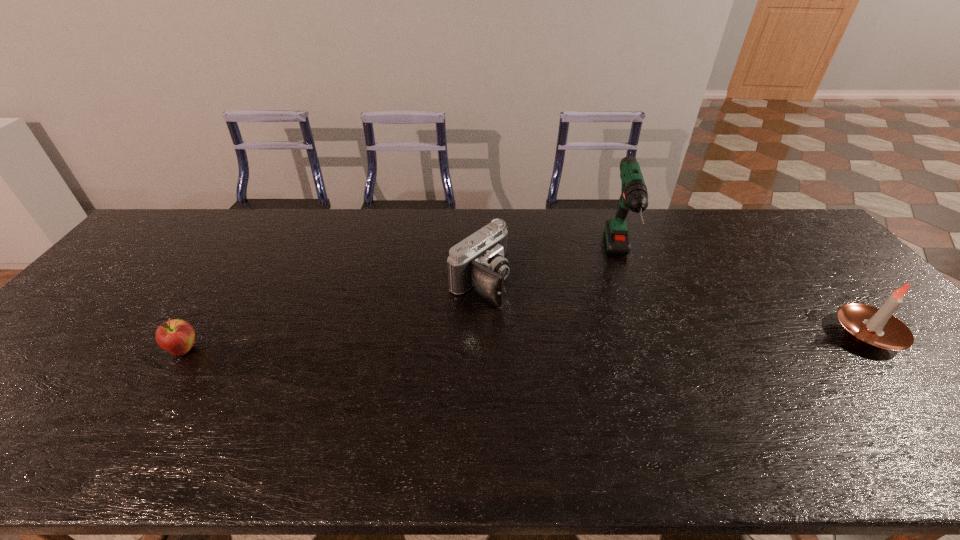
Locate an element on the screen. free space on the desktop that is between the apple and the candle and is positioned at the front of the second object from left to right with an open lens cover is located at coordinates coord(578,340).

At what (x,y) coordinates should I click in order to perform the action: click on vacant space on the desktop that is between the leftmost object and the rightmost object and is positioned on the handle side of the tallest object. Please return your answer as a coordinate pair (x, y). This screenshot has height=540, width=960. Looking at the image, I should click on (634, 339).